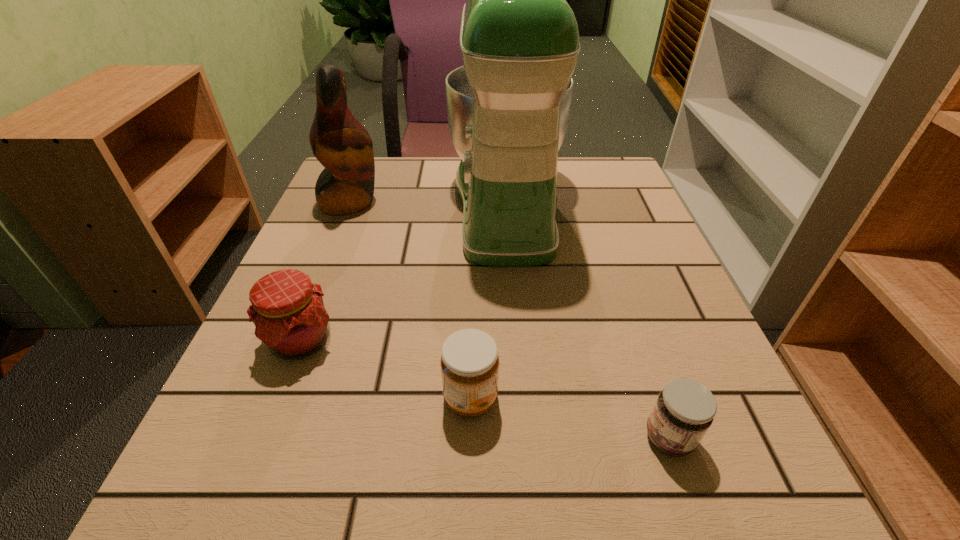
You are a GUI agent. You are given a task and a screenshot of the screen. Output one action in this format:
    pyautogui.click(x=<x>, y=<y>)
    Task: Click on the jam identified as the closest to the shortest jam
    Image resolution: width=960 pixels, height=540 pixels.
    Given the screenshot: What is the action you would take?
    pyautogui.click(x=469, y=362)

What are the coordinates of `the closest jam to the second jam from right to left` in the screenshot? It's located at (288, 311).

This screenshot has width=960, height=540. Identify the location of vacant space that satisfies the following two spatial constraints: 1. on the face of the parrot; 2. on the back side of the leftmost jam. (294, 340).

Where is `blank area in the image that satisfies the following two spatial constraints: 1. on the face of the parrot; 2. on the right side of the farthest jam`? blank area in the image that satisfies the following two spatial constraints: 1. on the face of the parrot; 2. on the right side of the farthest jam is located at coordinates (294, 340).

Image resolution: width=960 pixels, height=540 pixels. Find the location of `vacant position in the image that satisfies the following two spatial constraints: 1. on the face of the leftmost jam; 2. on the left side of the second tallest object`. vacant position in the image that satisfies the following two spatial constraints: 1. on the face of the leftmost jam; 2. on the left side of the second tallest object is located at coordinates (294, 340).

Locate an element on the screen. blank space that satisfies the following two spatial constraints: 1. on the face of the second tallest object; 2. on the right side of the third nearest object is located at coordinates (294, 340).